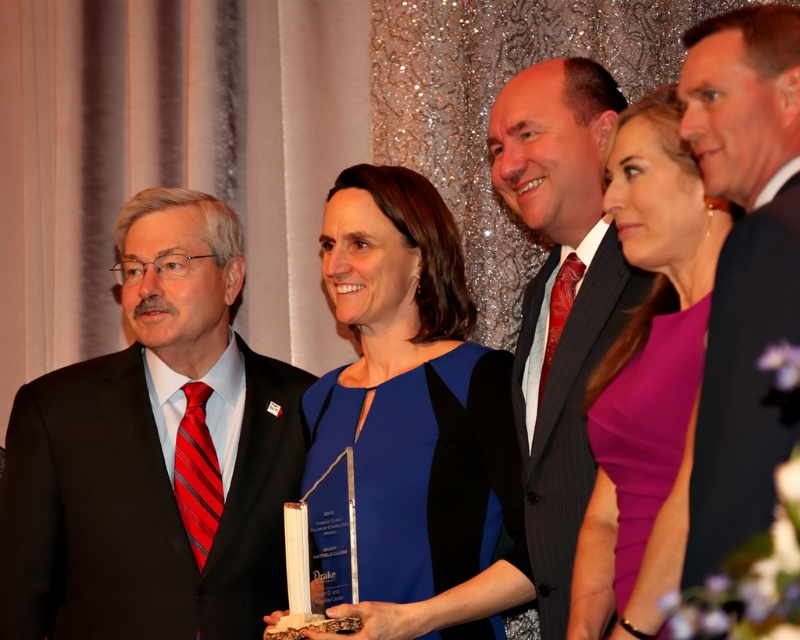
Question: Which of the following is the closest to the observer?

Choices:
 (A) (564, 579)
 (B) (694, 77)
 (C) (450, 413)
 (D) (608, 518)

Answer: (B)

Question: Which point is closer to the camera?

Choices:
 (A) (210, 616)
 (B) (654, 321)
 (C) (726, 365)

Answer: (C)

Question: Is blue satin dress at center above shiny black suit at center?

Choices:
 (A) no
 (B) yes

Answer: (A)

Question: Observing the image, what is the correct spatial positioning of matte black suit at left in reference to purple satin dress at center?

Choices:
 (A) below
 (B) above

Answer: (A)

Question: Is purple satin dress at center behind shiny black suit at center?

Choices:
 (A) no
 (B) yes

Answer: (A)

Question: Which is nearer to the blue satin dress at center?

Choices:
 (A) black suit at right
 (B) matte black suit at left
 (C) purple satin dress at center

Answer: (B)